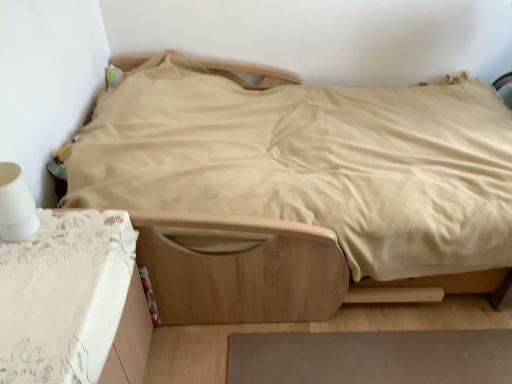
This screenshot has height=384, width=512. I want to click on empty space that is ontop of white lace tablecloth at lower left (from a real-world perspective), so click(49, 275).